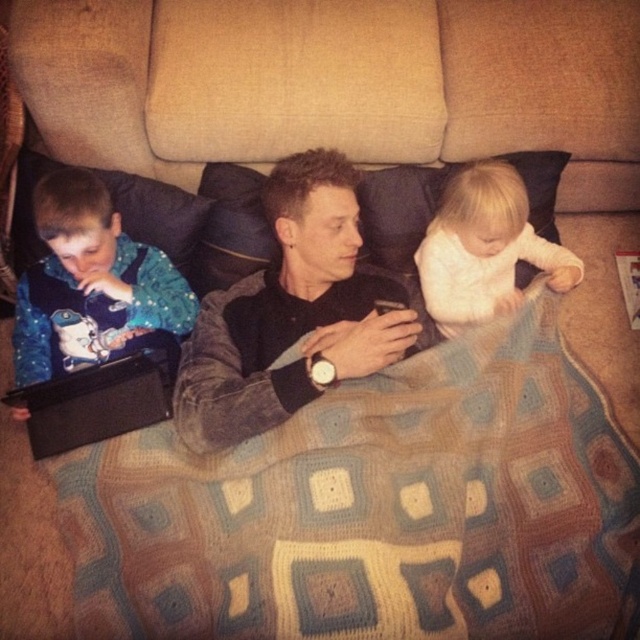
Which is in front, point (248, 582) or point (132, 285)?

Positioned in front is point (248, 582).

Does knitted wool blanket at center have a larger size compared to blue fabric baby at left?

Indeed, knitted wool blanket at center has a larger size compared to blue fabric baby at left.

Find the location of a particular element. This screenshot has height=640, width=640. knitted wool blanket at center is located at coordinates (372, 508).

The image size is (640, 640). In order to click on blue fabric baby at left in this screenshot , I will do `click(90, 284)`.

Does blue fabric baby at left appear under white soft fabric at center?

Correct, blue fabric baby at left is located below white soft fabric at center.

Does point (104, 356) come in front of point (483, 182)?

No, (104, 356) is behind (483, 182).

This screenshot has width=640, height=640. Find the location of `blue fabric baby at left`. blue fabric baby at left is located at coordinates (90, 284).

Is suede black jacket at center behind white soft fabric at center?

No, it is in front of white soft fabric at center.

Is suede black jacket at center below white soft fabric at center?

Yes.

Image resolution: width=640 pixels, height=640 pixels. Describe the element at coordinates (291, 314) in the screenshot. I see `suede black jacket at center` at that location.

Identify the location of suede black jacket at center. The height and width of the screenshot is (640, 640). click(291, 314).